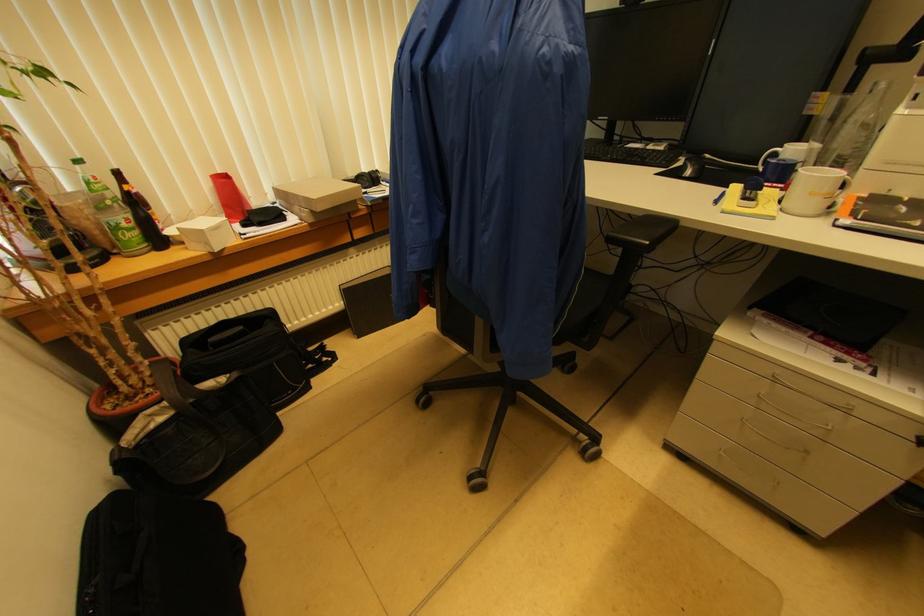
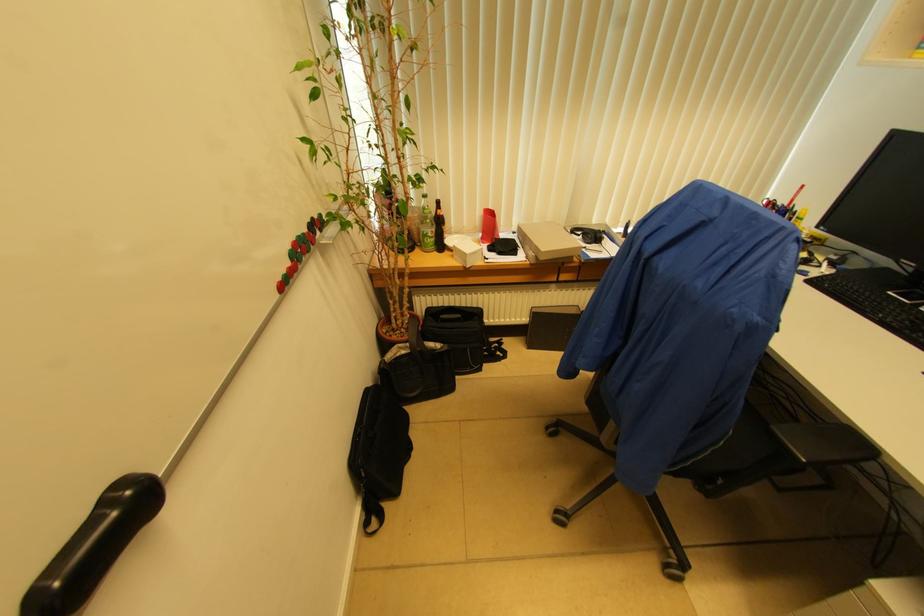
In the second image, find the point that corresponds to point (332, 362) in the first image.

(503, 358)